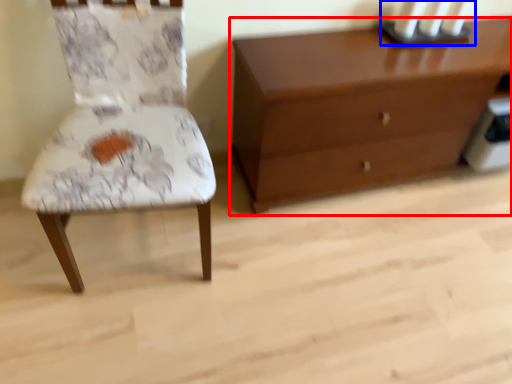
Question: Among these objects, which one is nearest to the camera, chest of drawers (highlighted by a red box) or candle holder (highlighted by a blue box)?

Choices:
 (A) chest of drawers
 (B) candle holder

Answer: (A)